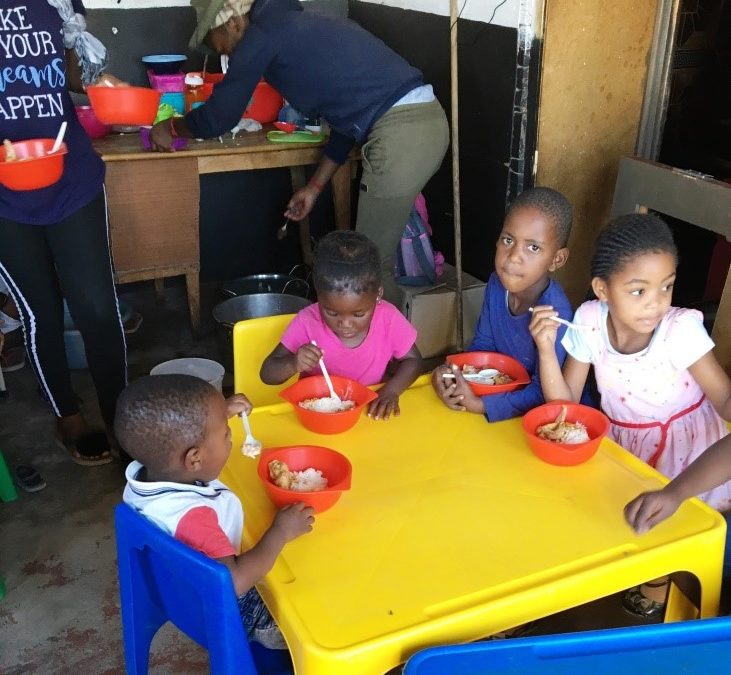
At what (x,y) coordinates should I click in order to perform the action: click on red bowl. Please return your answer as a coordinate pair (x, y). This screenshot has height=675, width=731. Looking at the image, I should click on (566, 445), (556, 435).